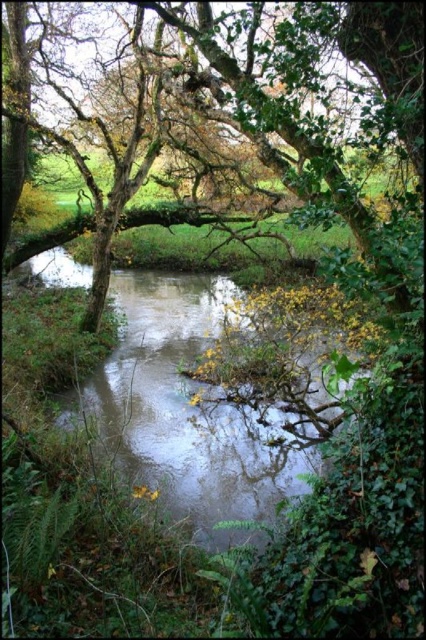
Measure the distance between clear water at center and green leafy tree at center.

7.07 meters

Is point (252, 468) positioned after point (365, 8)?

Yes, point (252, 468) is farther from viewer.

Where is `clear water at center`? Image resolution: width=426 pixels, height=640 pixels. clear water at center is located at coordinates 189,410.